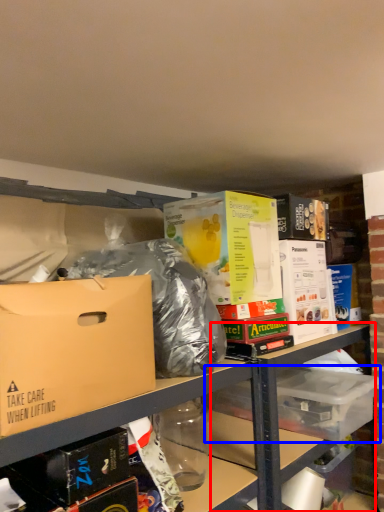
Question: Which object appears closest to the camera in this image, table (highlighted by a red box) or storage box (highlighted by a blue box)?

Choices:
 (A) table
 (B) storage box

Answer: (A)